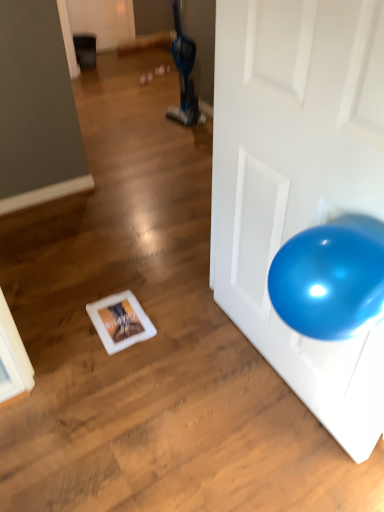
Question: In terms of size, does blue fabric bean bag chair at upper center appear bigger or smaller than glossy white door at right?

Choices:
 (A) small
 (B) big

Answer: (A)

Question: Is blue fabric bean bag chair at upper center taller or shorter than glossy white door at right?

Choices:
 (A) short
 (B) tall

Answer: (A)

Question: From the image's perspective, is blue fabric bean bag chair at upper center located above or below glossy white door at right?

Choices:
 (A) above
 (B) below

Answer: (A)

Question: Which is correct: glossy white door at right is inside blue fabric bean bag chair at upper center, or outside of it?

Choices:
 (A) outside
 (B) inside

Answer: (A)

Question: In terms of height, does glossy white door at right look taller or shorter compared to blue fabric bean bag chair at upper center?

Choices:
 (A) short
 (B) tall

Answer: (B)

Question: Is glossy white door at right wider or thinner than blue fabric bean bag chair at upper center?

Choices:
 (A) wide
 (B) thin

Answer: (B)

Question: Is glossy white door at right in front of or behind blue fabric bean bag chair at upper center in the image?

Choices:
 (A) behind
 (B) front

Answer: (B)